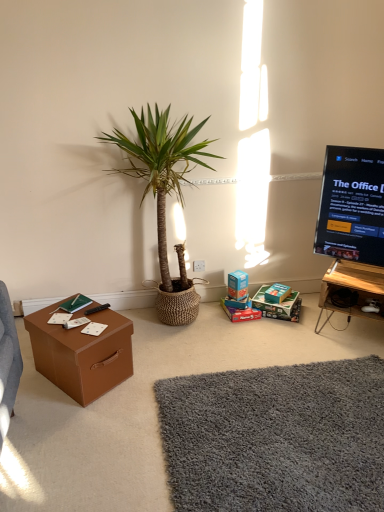
This screenshot has width=384, height=512. Identify the location of vacant region below shaggy gray rug at lower center, placed as the 2th plain when sorted from front to back (from a real-world perspective). (275, 436).